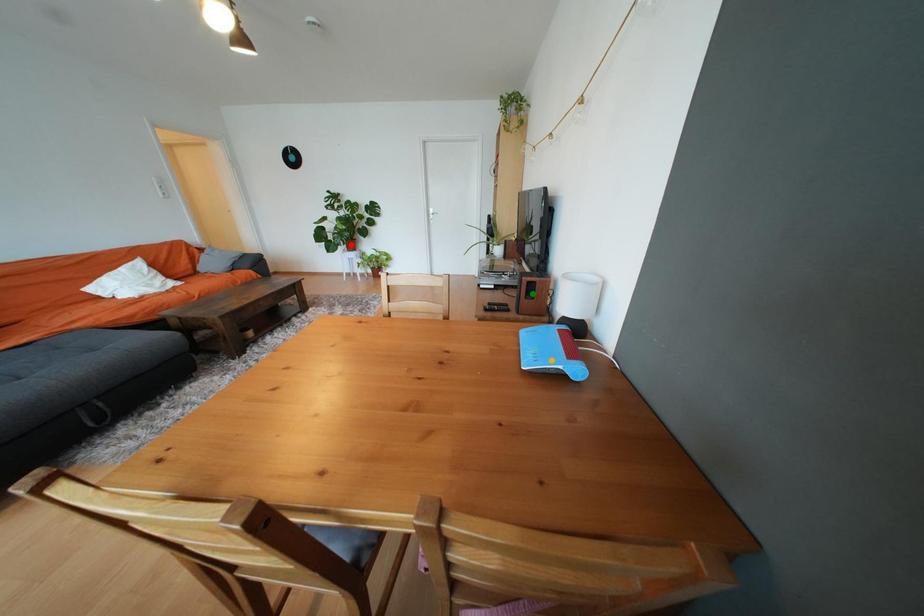
Order these from nearest to farthest:
- red point
- orange point
- green point

orange point → green point → red point